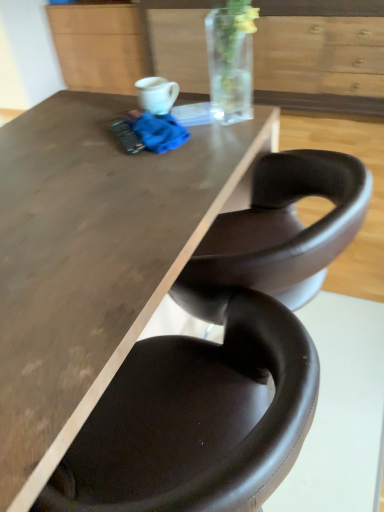
Question: Based on their positions, is white glossy mug at upper center located to the left or right of matte wood cabinet at upper center?

Choices:
 (A) left
 (B) right

Answer: (B)

Question: Considering the positions of point (178, 93) and point (119, 51), is point (178, 93) closer or farther from the camera than point (119, 51)?

Choices:
 (A) farther
 (B) closer

Answer: (B)

Question: Which is farther from the brown leather chair at lower center?

Choices:
 (A) matte brown table at center
 (B) white glossy mug at upper center
 (C) matte wood cabinet at upper center
 (D) wooden drawer at upper center

Answer: (C)

Question: Which of these objects is positioned farthest from the matte wood cabinet at upper center?

Choices:
 (A) brown leather chair at lower center
 (B) matte brown table at center
 (C) white glossy mug at upper center
 (D) wooden drawer at upper center

Answer: (A)